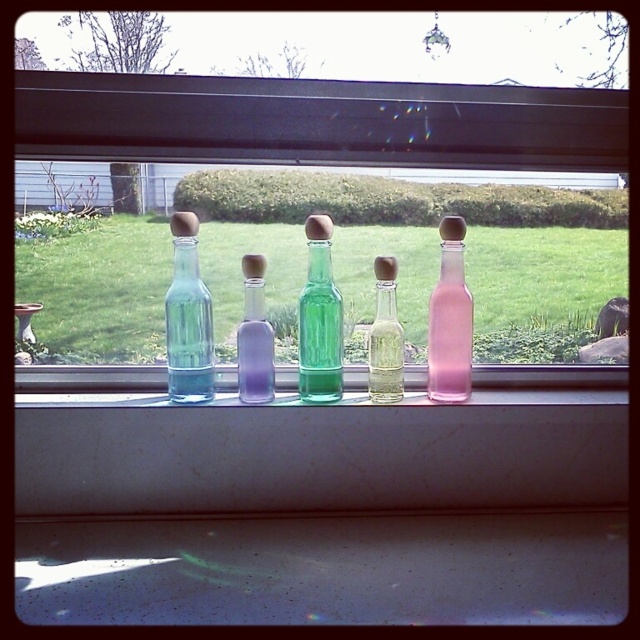
Question: Is green glass bottle at center below translucent glass bottle at center?

Choices:
 (A) no
 (B) yes

Answer: (A)

Question: Among these points, which one is farthest from the camera?

Choices:
 (A) (620, 282)
 (B) (584, 449)

Answer: (A)

Question: Which point is closer to the camera?

Choices:
 (A) (381, 368)
 (B) (96, 196)

Answer: (A)

Question: From the image, what is the correct spatial relationship of transparent glass bottles at center in relation to clear glass bottles at center?

Choices:
 (A) left
 (B) right

Answer: (A)

Question: Does pink glass bottle at center appear on the left side of translucent glass bottle at center?

Choices:
 (A) no
 (B) yes

Answer: (A)

Question: Which of these objects is positioned farthest from the transparent glass bottle at center?

Choices:
 (A) translucent glass bottle at center
 (B) pink glass bottle at center

Answer: (B)